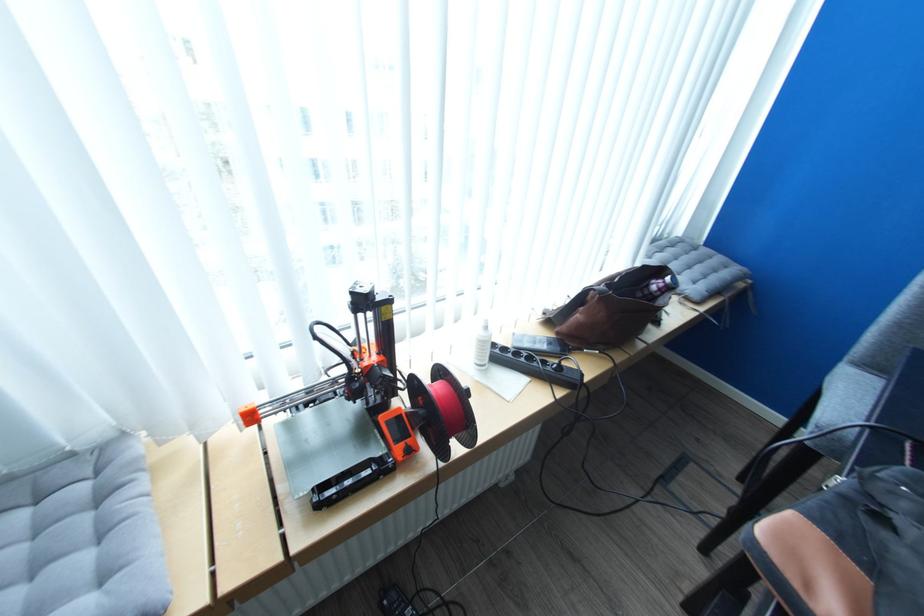
What do you see at coordinates (540, 341) in the screenshot?
I see `the black smartphone` at bounding box center [540, 341].